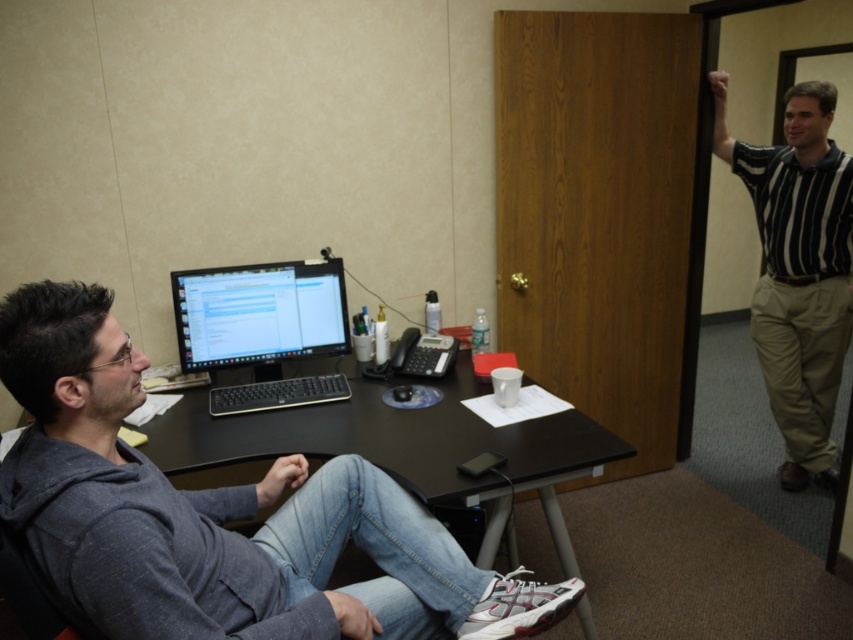
You are standing at point (x=201, y=316) and want to walk to the door located at point (x=233, y=550). Is there any obstruction between these two points?

Point (x=233, y=550) is in front of point (x=201, y=316), so there is no obstruction between them.

You are a delivery person who needs to place a package on the desk where the gray hoodie at left is sitting. The package is 1.2 meters tall. Can you safely place it there without it blocking the matte black monitor at center?

The gray hoodie at left is much taller than the matte black monitor at center, so the monitor is shorter. Since the package is 1.2 meters tall, it might block the matte black monitor at center if placed near it. Check the desk space and ensure the package doesn

You are an office worker who needs to move the gray hoodie at left and the matte black monitor at center to make space for a new printer. Based on their sizes, which object should you move first to ensure enough space for the printer?

The gray hoodie at left is larger in size than the matte black monitor at center, so you should move the gray hoodie at left first to create sufficient space for the new printer.